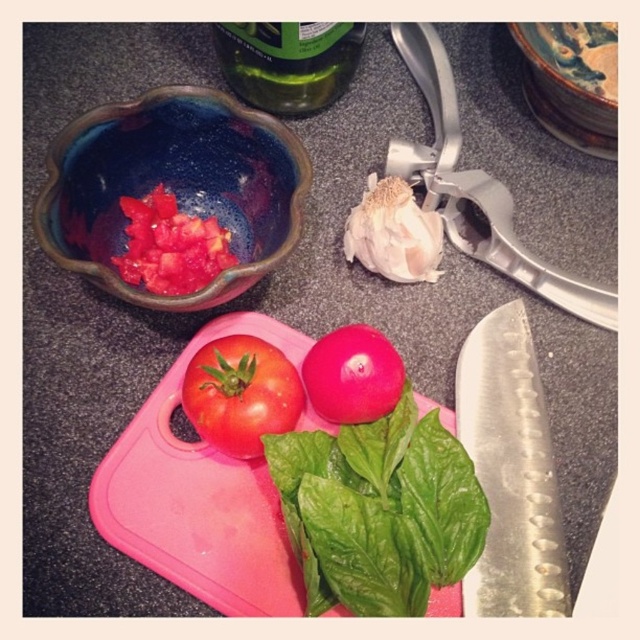
You are preparing a salad and need to grab the silver metallic knife at lower right and the green glass bottle at upper center. Which one is located more to the right side?

The silver metallic knife at lower right is positioned on the right side of green glass bottle at upper center, so it is more to the right.

You are preparing a salad and need to slice the red matte tomato at center. You have the silver metallic knife at lower right. Will the knife fit through the middle of the tomato without touching the sides?

The silver metallic knife at lower right is thinner than the red matte tomato at center, so yes, the knife will fit through the middle of the tomato without touching the sides.